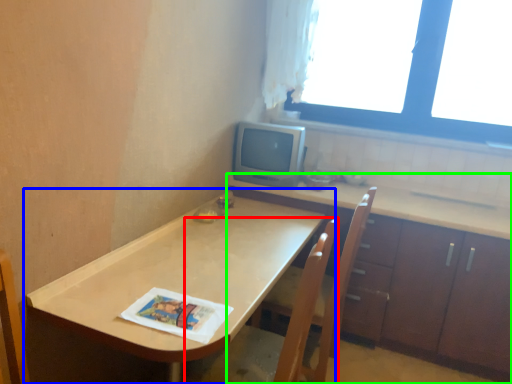
Question: Which object is positioned closest to swivel chair (highlighted by a red box)? Select from table (highlighted by a blue box) and cabinetry (highlighted by a green box).

Choices:
 (A) table
 (B) cabinetry

Answer: (A)